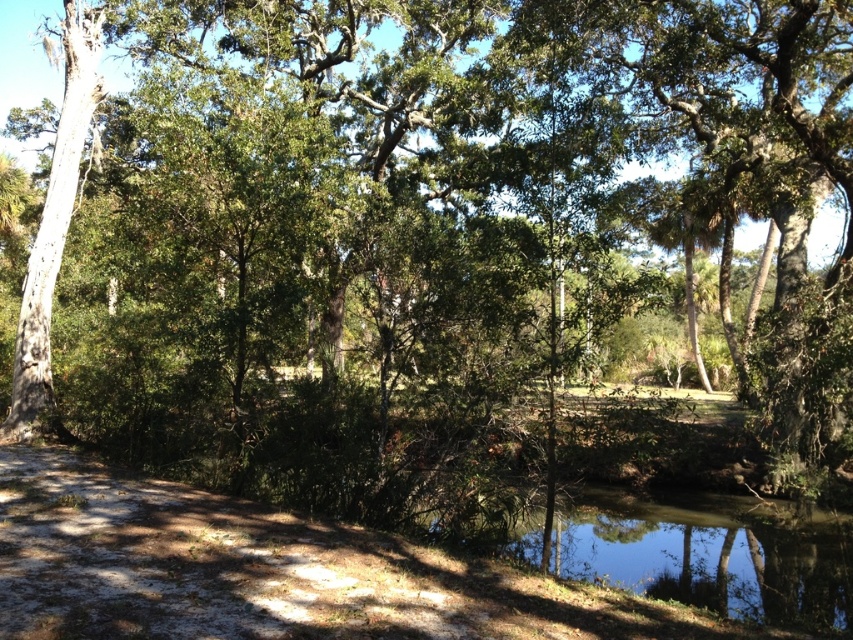
Does clear water at lower center have a lesser width compared to smooth white tree trunk at left?

Incorrect, clear water at lower center's width is not less than smooth white tree trunk at left's.

Can you confirm if clear water at lower center is shorter than smooth white tree trunk at left?

Correct, clear water at lower center is not as tall as smooth white tree trunk at left.

The width and height of the screenshot is (853, 640). What are the coordinates of `clear water at lower center` in the screenshot? It's located at (711, 554).